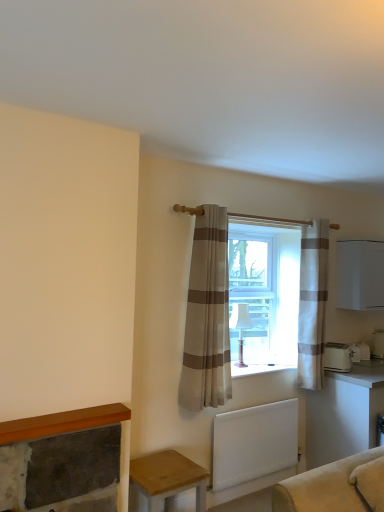
Question: Does white glossy table at lower right, the second table from the left, lie in front of white matte radiator at lower center?

Choices:
 (A) yes
 (B) no

Answer: (B)

Question: Is white glossy table at lower right, the first table from the right, not close to white matte radiator at lower center?

Choices:
 (A) no
 (B) yes

Answer: (A)

Question: From a real-world perspective, is white glossy table at lower right, the first table from the right, located beneath white matte radiator at lower center?

Choices:
 (A) no
 (B) yes

Answer: (A)

Question: Is the position of white glossy table at lower right, the second table from the left, more distant than that of white matte radiator at lower center?

Choices:
 (A) yes
 (B) no

Answer: (A)

Question: Considering the relative sizes of white glossy table at lower right, the first table from the right, and white matte radiator at lower center in the image provided, is white glossy table at lower right, the first table from the right, thinner than white matte radiator at lower center?

Choices:
 (A) no
 (B) yes

Answer: (A)

Question: Is white glossy table at lower right, which is the 1th table in back-to-front order, shorter than white matte radiator at lower center?

Choices:
 (A) no
 (B) yes

Answer: (A)

Question: From the image's perspective, is wooden table at lower left, which is the first table in front-to-back order, beneath beige striped curtain at center, placed as the 2th curtain when sorted from right to left?

Choices:
 (A) yes
 (B) no

Answer: (A)

Question: Does wooden table at lower left, marked as the second table in a right-to-left arrangement, have a lesser width compared to beige striped curtain at center, placed as the first curtain when sorted from left to right?

Choices:
 (A) no
 (B) yes

Answer: (A)

Question: Considering the relative positions of wooden table at lower left, placed as the first table when sorted from left to right, and beige striped curtain at center, which is the second curtain in back-to-front order, in the image provided, is wooden table at lower left, placed as the first table when sorted from left to right, to the left of beige striped curtain at center, which is the second curtain in back-to-front order, from the viewer's perspective?

Choices:
 (A) yes
 (B) no

Answer: (A)

Question: From a real-world perspective, is wooden table at lower left, arranged as the second table when viewed from the back, positioned over beige striped curtain at center, placed as the first curtain when sorted from left to right, based on gravity?

Choices:
 (A) yes
 (B) no

Answer: (B)

Question: From a real-world perspective, is wooden table at lower left, marked as the second table in a right-to-left arrangement, positioned under beige striped curtain at center, placed as the 2th curtain when sorted from right to left, based on gravity?

Choices:
 (A) no
 (B) yes

Answer: (B)

Question: Is wooden table at lower left, placed as the first table when sorted from left to right, further to camera compared to beige striped curtain at center, which is the second curtain in back-to-front order?

Choices:
 (A) no
 (B) yes

Answer: (A)

Question: Is white glossy table at lower right, which is the 1th table in back-to-front order, located outside beige striped curtain at center, placed as the 2th curtain when sorted from right to left?

Choices:
 (A) yes
 (B) no

Answer: (A)